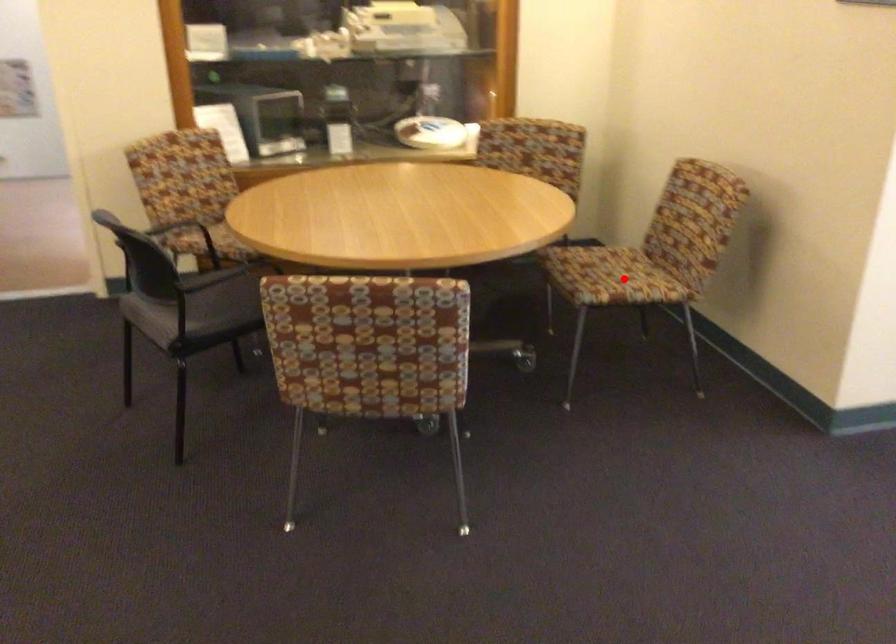
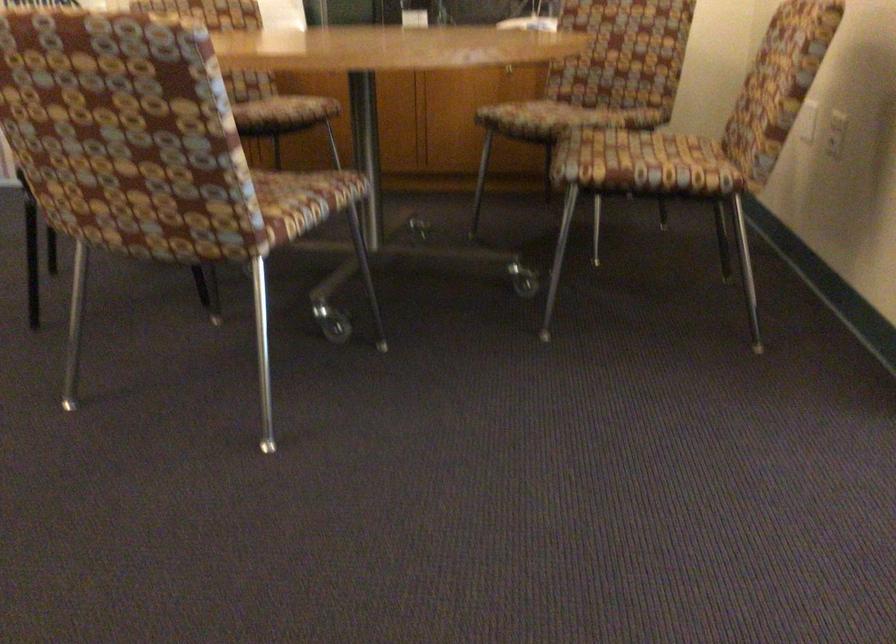
Question: I am providing you with two images of the same scene from different viewpoints. In image1, a red point is highlighted. Considering the same 3D point in image2, which of the following is correct?

Choices:
 (A) It is closer
 (B) It is farther

Answer: (A)